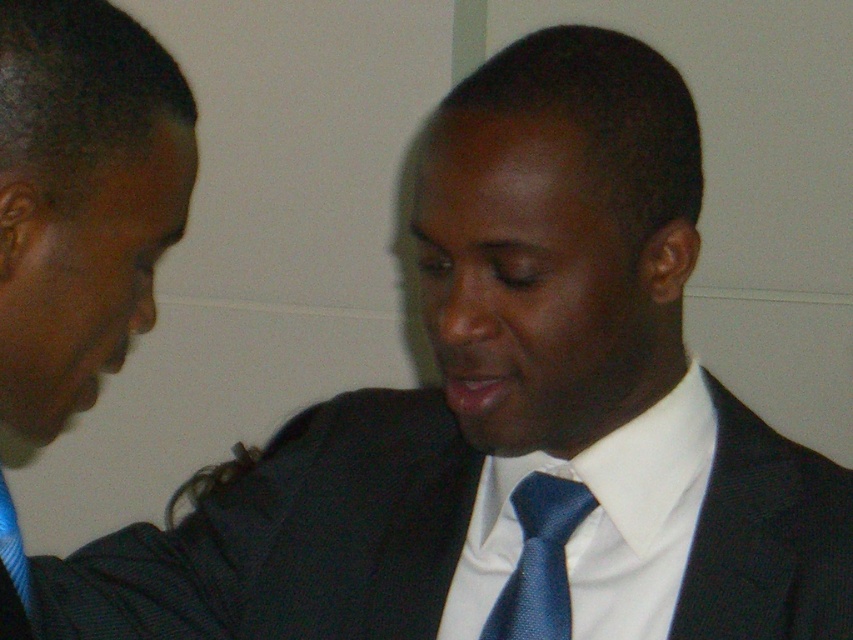
Question: Does matte black suit at left appear on the right side of blue textured tie at center?

Choices:
 (A) yes
 (B) no

Answer: (B)

Question: Can you confirm if matte black suit at left is positioned to the left of blue textured tie at center?

Choices:
 (A) no
 (B) yes

Answer: (B)

Question: Which object appears closest to the camera in this image?

Choices:
 (A) white satin dress shirt at center
 (B) matte black suit at left
 (C) matte black suit at center
 (D) blue textured tie at center

Answer: (B)

Question: Which point is closer to the camera?

Choices:
 (A) blue textured tie at center
 (B) white satin dress shirt at center
 (C) matte black suit at center
 (D) matte black suit at left

Answer: (D)

Question: Can you confirm if matte black suit at center is wider than blue textured tie at center?

Choices:
 (A) no
 (B) yes

Answer: (B)

Question: Which object is closer to the camera taking this photo?

Choices:
 (A) matte black suit at left
 (B) blue textured tie at center

Answer: (A)